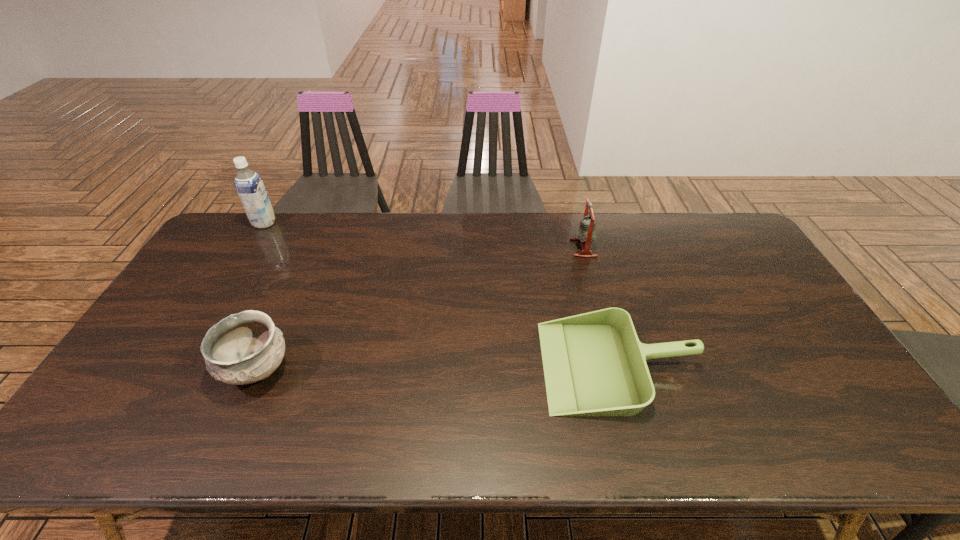
The image size is (960, 540). I want to click on vacant area situated on the scoop of the dustpan, so click(478, 366).

Find the location of a particular element. The image size is (960, 540). vacant position located on the scoop of the dustpan is located at coordinates (437, 366).

This screenshot has width=960, height=540. I want to click on free space located 0.350m on the scoop of the dustpan, so click(410, 366).

Image resolution: width=960 pixels, height=540 pixels. I want to click on soya milk that is at the far edge, so click(249, 185).

Where is `bell that is at the far edge`? bell that is at the far edge is located at coordinates (586, 233).

The width and height of the screenshot is (960, 540). I want to click on object at the near edge, so click(594, 364).

The height and width of the screenshot is (540, 960). Find the location of `object at the left edge`. object at the left edge is located at coordinates (249, 185).

What are the coordinates of `object that is at the far left corner` in the screenshot? It's located at (249, 185).

In the image, there is a desktop. Where is `vacant space at the far edge`? vacant space at the far edge is located at coordinates (410, 212).

Locate an element on the screen. free location at the near edge of the desktop is located at coordinates (480, 423).